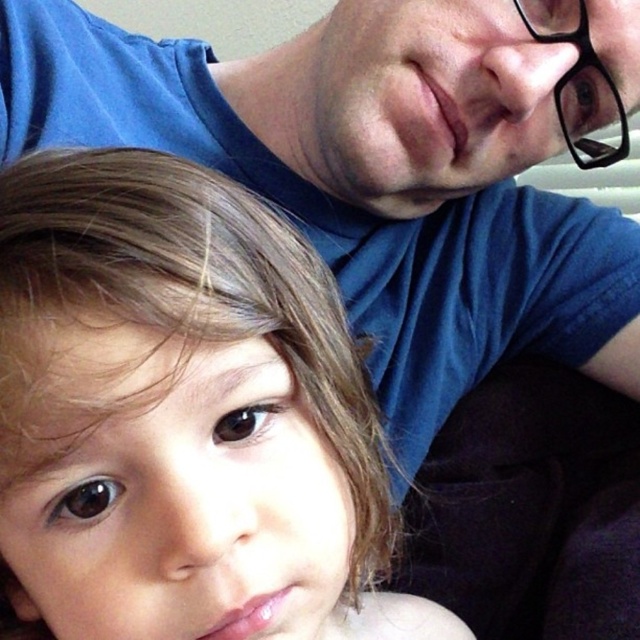
Question: Does smooth skin child at lower left lie in front of black plastic glasses at upper right?

Choices:
 (A) no
 (B) yes

Answer: (B)

Question: Among these points, which one is nearest to the camera?

Choices:
 (A) (74, 344)
 (B) (518, 0)

Answer: (A)

Question: Does smooth skin child at lower left appear under black plastic glasses at upper right?

Choices:
 (A) yes
 (B) no

Answer: (A)

Question: Can you confirm if smooth skin child at lower left is thinner than black plastic glasses at upper right?

Choices:
 (A) yes
 (B) no

Answer: (B)

Question: Which of the following is the closest to the observer?

Choices:
 (A) black plastic glasses at upper right
 (B) smooth skin child at lower left

Answer: (B)